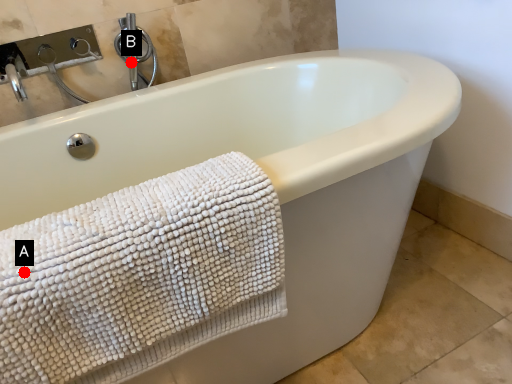
Question: Two points are circled on the image, labeled by A and B beside each circle. Which point is farther from the camera taking this photo?

Choices:
 (A) A is further
 (B) B is further

Answer: (B)